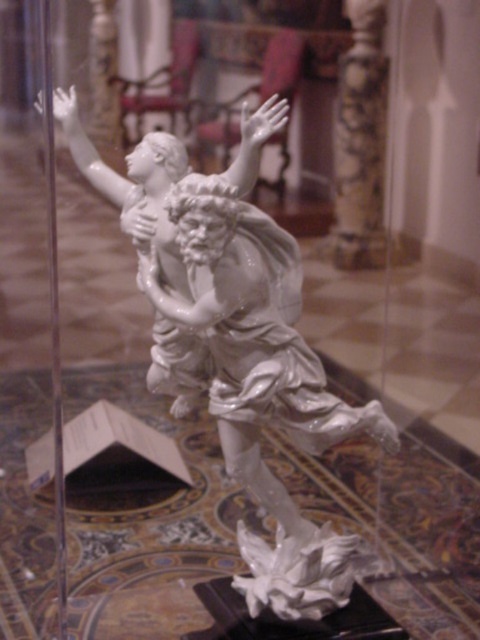
Question: Which point is farther to the camera?

Choices:
 (A) (178, 148)
 (B) (336, 112)

Answer: (B)

Question: Is the position of white glossy statue at center more distant than that of white marble column at center?

Choices:
 (A) yes
 (B) no

Answer: (B)

Question: Which point is farther to the camera?

Choices:
 (A) white marble column at center
 (B) white glossy statue at center

Answer: (A)

Question: Can you confirm if white glossy statue at center is smaller than white marble column at center?

Choices:
 (A) no
 (B) yes

Answer: (A)

Question: Where is white glossy statue at center located in relation to white marble column at center in the image?

Choices:
 (A) left
 (B) right

Answer: (A)